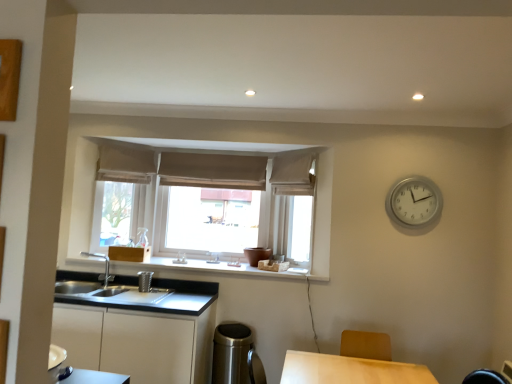
Where is `free space above polished stainless steel trash can at lower center (from a real-world perspective)`? The image size is (512, 384). free space above polished stainless steel trash can at lower center (from a real-world perspective) is located at coordinates (234, 330).